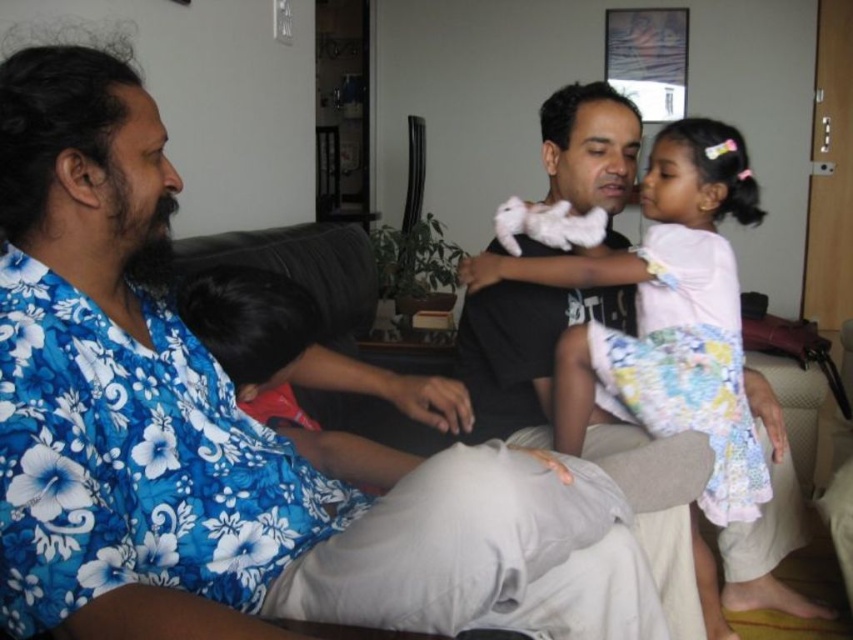
Is white cotton dress at center taller than black fabric at left?

Yes, white cotton dress at center is taller than black fabric at left.

The image size is (853, 640). I want to click on white cotton dress at center, so click(665, 316).